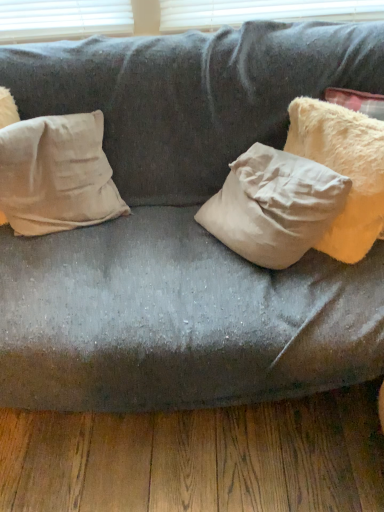
Describe the element at coordinates (56, 174) in the screenshot. I see `beige cotton pillow at left, which appears as the 1th pillow when viewed from the left` at that location.

Identify the location of beige cotton pillow at left, which appears as the 1th pillow when viewed from the left. (56, 174).

The width and height of the screenshot is (384, 512). What do you see at coordinates (344, 170) in the screenshot?
I see `fuzzy cream pillow at right, acting as the first pillow starting from the right` at bounding box center [344, 170].

The height and width of the screenshot is (512, 384). Find the location of `fuzzy cream pillow at right, acting as the first pillow starting from the right`. fuzzy cream pillow at right, acting as the first pillow starting from the right is located at coordinates (344, 170).

I want to click on beige cotton pillow at left, which appears as the 1th pillow when viewed from the left, so click(x=56, y=174).

Between beige cotton pillow at left, which is the second pillow in right-to-left order, and fuzzy cream pillow at right, acting as the 2th pillow starting from the left, which one appears on the right side from the viewer's perspective?

fuzzy cream pillow at right, acting as the 2th pillow starting from the left, is more to the right.

Who is more distant, beige cotton pillow at left, which is the second pillow in right-to-left order, or fuzzy cream pillow at right, acting as the first pillow starting from the right?

beige cotton pillow at left, which is the second pillow in right-to-left order, is further from the camera.

Between point (30, 195) and point (327, 103), which one is positioned in front?

The point (327, 103) is closer.

Based on the photo, from the image's perspective, is beige cotton pillow at left, which appears as the 1th pillow when viewed from the left, over fuzzy cream pillow at right, acting as the first pillow starting from the right?

Incorrect, from the image's perspective, beige cotton pillow at left, which appears as the 1th pillow when viewed from the left, is lower than fuzzy cream pillow at right, acting as the first pillow starting from the right.

From a real-world perspective, who is located higher, beige cotton pillow at left, which is the second pillow in right-to-left order, or fuzzy cream pillow at right, acting as the 2th pillow starting from the left?

From a 3D spatial view, fuzzy cream pillow at right, acting as the 2th pillow starting from the left, is above.

Looking at this image, is beige cotton pillow at left, which is the second pillow in right-to-left order, thinner than fuzzy cream pillow at right, acting as the first pillow starting from the right?

Correct, the width of beige cotton pillow at left, which is the second pillow in right-to-left order, is less than that of fuzzy cream pillow at right, acting as the first pillow starting from the right.

Considering the relative sizes of beige cotton pillow at left, which is the second pillow in right-to-left order, and fuzzy cream pillow at right, acting as the first pillow starting from the right, in the image provided, is beige cotton pillow at left, which is the second pillow in right-to-left order, shorter than fuzzy cream pillow at right, acting as the first pillow starting from the right,?

Yes, beige cotton pillow at left, which is the second pillow in right-to-left order, is shorter than fuzzy cream pillow at right, acting as the first pillow starting from the right.

Is beige cotton pillow at left, which is the second pillow in right-to-left order, bigger or smaller than fuzzy cream pillow at right, acting as the 2th pillow starting from the left?

Clearly, beige cotton pillow at left, which is the second pillow in right-to-left order, is smaller in size than fuzzy cream pillow at right, acting as the 2th pillow starting from the left.

Would you say beige cotton pillow at left, which is the second pillow in right-to-left order, is outside fuzzy cream pillow at right, acting as the first pillow starting from the right?

Yes.

Is there a large distance between beige cotton pillow at left, which appears as the 1th pillow when viewed from the left, and fuzzy cream pillow at right, acting as the first pillow starting from the right?

That's not correct — beige cotton pillow at left, which appears as the 1th pillow when viewed from the left, is a little close to fuzzy cream pillow at right, acting as the first pillow starting from the right.

Is fuzzy cream pillow at right, acting as the 2th pillow starting from the left, at the back of beige cotton pillow at left, which is the second pillow in right-to-left order?

beige cotton pillow at left, which is the second pillow in right-to-left order, does not have its back to fuzzy cream pillow at right, acting as the 2th pillow starting from the left.

How many degrees apart are the facing directions of beige cotton pillow at left, which is the second pillow in right-to-left order, and fuzzy cream pillow at right, acting as the first pillow starting from the right?

41.7 degrees separate the facing orientations of beige cotton pillow at left, which is the second pillow in right-to-left order, and fuzzy cream pillow at right, acting as the first pillow starting from the right.

At what (x,y) coordinates should I click in order to perform the action: click on pillow that is on the right side of beige cotton pillow at left, which is the second pillow in right-to-left order. Please return your answer as a coordinate pair (x, y). Looking at the image, I should click on (344, 170).

Which is more to the left, fuzzy cream pillow at right, acting as the 2th pillow starting from the left, or beige cotton pillow at left, which is the second pillow in right-to-left order?

beige cotton pillow at left, which is the second pillow in right-to-left order.

Which object is further away from the camera, fuzzy cream pillow at right, acting as the first pillow starting from the right, or beige cotton pillow at left, which is the second pillow in right-to-left order?

beige cotton pillow at left, which is the second pillow in right-to-left order, is behind.

Which point is more distant from viewer, (302, 97) or (78, 129)?

Point (302, 97)

From the image's perspective, which one is positioned lower, fuzzy cream pillow at right, acting as the first pillow starting from the right, or beige cotton pillow at left, which is the second pillow in right-to-left order?

beige cotton pillow at left, which is the second pillow in right-to-left order.

Consider the image. From a real-world perspective, which is physically above, fuzzy cream pillow at right, acting as the 2th pillow starting from the left, or beige cotton pillow at left, which appears as the 1th pillow when viewed from the left?

From a 3D spatial view, fuzzy cream pillow at right, acting as the 2th pillow starting from the left, is above.

Is fuzzy cream pillow at right, acting as the 2th pillow starting from the left, wider or thinner than beige cotton pillow at left, which appears as the 1th pillow when viewed from the left?

Considering their sizes, fuzzy cream pillow at right, acting as the 2th pillow starting from the left, looks broader than beige cotton pillow at left, which appears as the 1th pillow when viewed from the left.

Which of these two, fuzzy cream pillow at right, acting as the first pillow starting from the right, or beige cotton pillow at left, which appears as the 1th pillow when viewed from the left, stands shorter?

beige cotton pillow at left, which appears as the 1th pillow when viewed from the left.

Between fuzzy cream pillow at right, acting as the first pillow starting from the right, and beige cotton pillow at left, which appears as the 1th pillow when viewed from the left, which one has smaller size?

beige cotton pillow at left, which appears as the 1th pillow when viewed from the left.

Is beige cotton pillow at left, which appears as the 1th pillow when viewed from the left, inside fuzzy cream pillow at right, acting as the first pillow starting from the right?

No, beige cotton pillow at left, which appears as the 1th pillow when viewed from the left, is not surrounded by fuzzy cream pillow at right, acting as the first pillow starting from the right.

Is fuzzy cream pillow at right, acting as the first pillow starting from the right, beside beige cotton pillow at left, which appears as the 1th pillow when viewed from the left?

They are not placed beside each other.

Is fuzzy cream pillow at right, acting as the first pillow starting from the right, turned away from beige cotton pillow at left, which appears as the 1th pillow when viewed from the left?

No, beige cotton pillow at left, which appears as the 1th pillow when viewed from the left, is not at the back of fuzzy cream pillow at right, acting as the first pillow starting from the right.

What's the angular difference between fuzzy cream pillow at right, acting as the 2th pillow starting from the left, and beige cotton pillow at left, which appears as the 1th pillow when viewed from the left,'s facing directions?

41.7 degrees.

This screenshot has width=384, height=512. In order to click on pillow below the fuzzy cream pillow at right, acting as the 2th pillow starting from the left (from the image's perspective) in this screenshot , I will do `click(56, 174)`.

The width and height of the screenshot is (384, 512). I want to click on pillow that appears below the fuzzy cream pillow at right, acting as the 2th pillow starting from the left (from the image's perspective), so click(x=56, y=174).

At what (x,y) coordinates should I click in order to perform the action: click on pillow to the left of fuzzy cream pillow at right, acting as the 2th pillow starting from the left. Please return your answer as a coordinate pair (x, y). The width and height of the screenshot is (384, 512). Looking at the image, I should click on (56, 174).